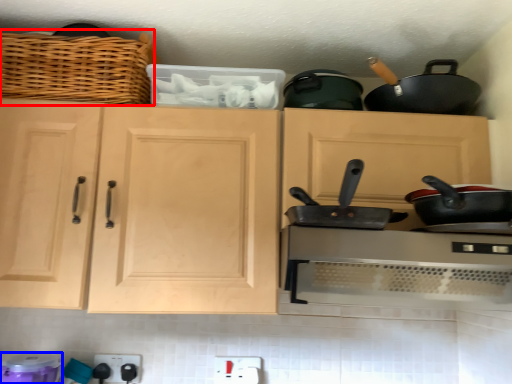
Question: Which object is further to the camera taking this photo, basket (highlighted by a red box) or appliance (highlighted by a blue box)?

Choices:
 (A) basket
 (B) appliance

Answer: (A)